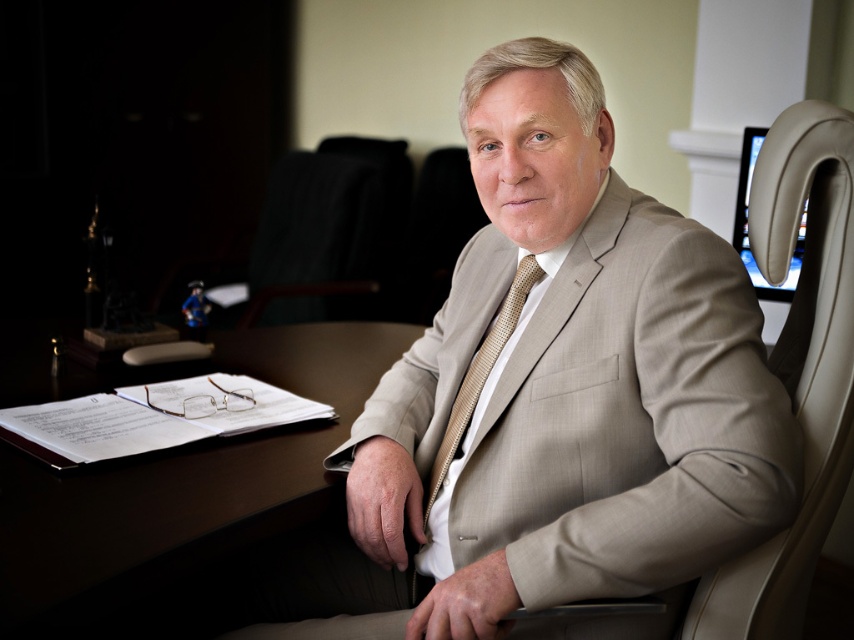
Question: Considering the relative positions of gold textured tie at center and beige leather monitor at upper right in the image provided, where is gold textured tie at center located with respect to beige leather monitor at upper right?

Choices:
 (A) right
 (B) left

Answer: (B)

Question: Which of the following is the closest to the observer?

Choices:
 (A) beige textured suit at center
 (B) beige leather swivel chair at right
 (C) gold textured tie at center

Answer: (B)

Question: Observing the image, what is the correct spatial positioning of beige textured suit at center in reference to beige leather monitor at upper right?

Choices:
 (A) below
 (B) above

Answer: (A)

Question: Is beige textured suit at center wider than beige leather monitor at upper right?

Choices:
 (A) yes
 (B) no

Answer: (A)

Question: Which object is positioned closest to the beige textured suit at center?

Choices:
 (A) beige leather monitor at upper right
 (B) gold textured tie at center
 (C) beige leather swivel chair at right

Answer: (B)

Question: Estimate the real-world distances between objects in this image. Which object is farther from the beige textured suit at center?

Choices:
 (A) dark wood table at center
 (B) beige leather monitor at upper right
 (C) gold textured tie at center

Answer: (B)